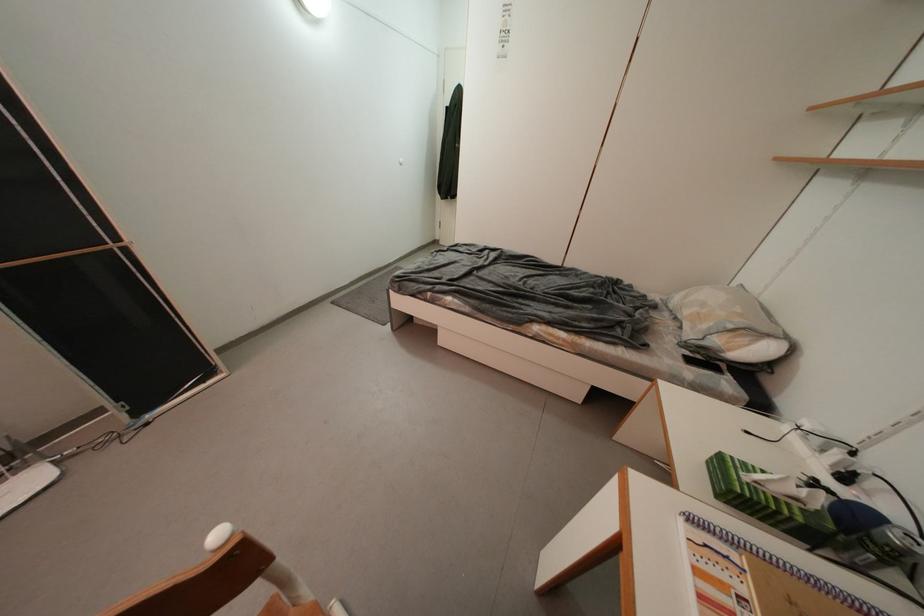
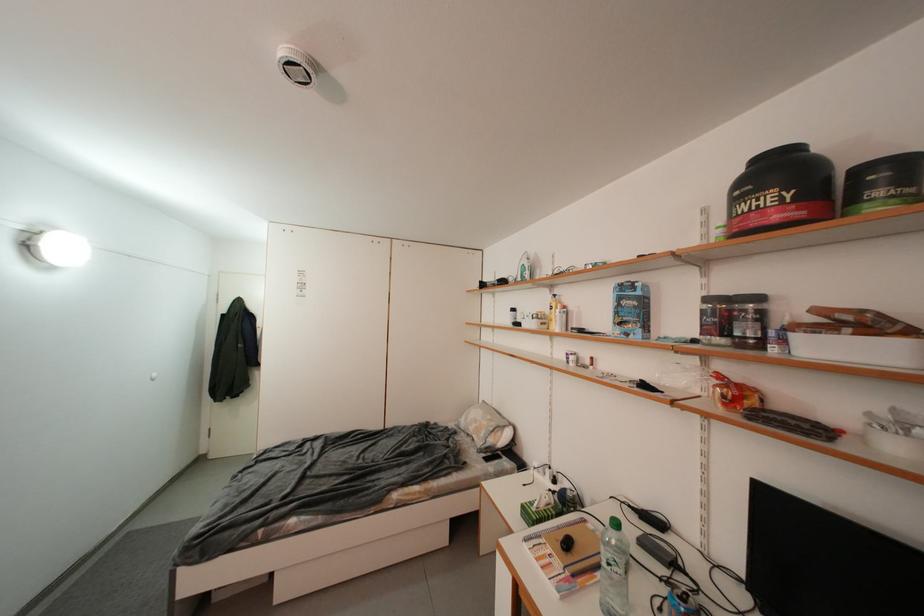
The point at (727, 460) is marked in the first image. Where is the corresponding point in the second image?

(530, 509)